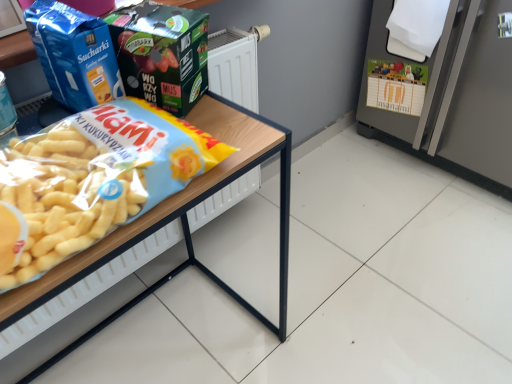
You are a GUI agent. You are given a task and a screenshot of the screen. Output one action in this format:
    pyautogui.click(x=<x>, y=<y>)
    Task: Click on the wooden table at left
    The height and width of the screenshot is (384, 512).
    Given the screenshot: What is the action you would take?
    pyautogui.click(x=180, y=221)

This screenshot has width=512, height=384. Describe the element at coordinates (74, 54) in the screenshot. I see `blue matte bag at upper left, placed as the first product when sorted from left to right` at that location.

I want to click on satin silver refrigerator at right, so pyautogui.click(x=456, y=94).

Locate an element on the screen. This screenshot has width=512, height=384. wooden table at left is located at coordinates (180, 221).

Is blue matte bag at upper left, positioned as the second product in right-to-left order, wider or thinner than matte green box at upper center, the second product in the left-to-right sequence?

In the image, blue matte bag at upper left, positioned as the second product in right-to-left order, appears to be more narrow than matte green box at upper center, the second product in the left-to-right sequence.

Which object is further away from the camera taking this photo, blue matte bag at upper left, placed as the first product when sorted from left to right, or matte green box at upper center, the second product in the left-to-right sequence?

matte green box at upper center, the second product in the left-to-right sequence.

Which is correct: blue matte bag at upper left, positioned as the second product in right-to-left order, is inside matte green box at upper center, the second product in the left-to-right sequence, or outside of it?

blue matte bag at upper left, positioned as the second product in right-to-left order, is not enclosed by matte green box at upper center, the second product in the left-to-right sequence.

In the image, is blue matte bag at upper left, positioned as the second product in right-to-left order, on the left side or the right side of matte green box at upper center, which is the first product from right to left?

blue matte bag at upper left, positioned as the second product in right-to-left order, is to the left of matte green box at upper center, which is the first product from right to left.

Is wooden table at left directly adjacent to blue matte bag at upper left, placed as the first product when sorted from left to right?

No, wooden table at left is not beside blue matte bag at upper left, placed as the first product when sorted from left to right.

From the image's perspective, is wooden table at left below blue matte bag at upper left, positioned as the second product in right-to-left order?

Yes.

From a real-world perspective, does wooden table at left stand above blue matte bag at upper left, placed as the first product when sorted from left to right?

No, from a real-world perspective, wooden table at left is not above blue matte bag at upper left, placed as the first product when sorted from left to right.

Is wooden table at left looking in the opposite direction of blue matte bag at upper left, positioned as the second product in right-to-left order?

wooden table at left is not turned away from blue matte bag at upper left, positioned as the second product in right-to-left order.

From the image's perspective, between matte green box at upper center, which is the first product from right to left, and satin silver refrigerator at right, which one is located above?

satin silver refrigerator at right is shown above in the image.

From a real-world perspective, which is physically below, matte green box at upper center, the second product in the left-to-right sequence, or satin silver refrigerator at right?

satin silver refrigerator at right is physically lower.

Is satin silver refrigerator at right completely or partially outside of blue matte bag at upper left, positioned as the second product in right-to-left order?

satin silver refrigerator at right is positioned outside blue matte bag at upper left, positioned as the second product in right-to-left order.

From a real-world perspective, is satin silver refrigerator at right on top of blue matte bag at upper left, placed as the first product when sorted from left to right?

No, from a real-world perspective, satin silver refrigerator at right is not over blue matte bag at upper left, placed as the first product when sorted from left to right

What are the coordinates of `the 2nd product below when counting from the satin silver refrigerator at right (from the image's perspective)` in the screenshot? It's located at (74, 54).

Does satin silver refrigerator at right have a larger size compared to blue matte bag at upper left, positioned as the second product in right-to-left order?

Yes.

Is wooden table at left far from satin silver refrigerator at right?

Actually, wooden table at left and satin silver refrigerator at right are a little close together.

From a real-world perspective, is wooden table at left positioned over satin silver refrigerator at right based on gravity?

No, from a real-world perspective, wooden table at left is not on top of satin silver refrigerator at right.

Which point is more distant from viewer, (250,311) or (449,162)?

The point (449,162) is farther from the camera.

From the image's perspective, is wooden table at left located above or below satin silver refrigerator at right?

From the image's perspective, wooden table at left appears below satin silver refrigerator at right.

From the image's perspective, would you say wooden table at left is positioned over matte green box at upper center, the second product in the left-to-right sequence?

Incorrect, from the image's perspective, wooden table at left is lower than matte green box at upper center, the second product in the left-to-right sequence.

Can you confirm if wooden table at left is smaller than matte green box at upper center, the second product in the left-to-right sequence?

Incorrect, wooden table at left is not smaller in size than matte green box at upper center, the second product in the left-to-right sequence.

Is wooden table at left thinner than matte green box at upper center, the second product in the left-to-right sequence?

In fact, wooden table at left might be wider than matte green box at upper center, the second product in the left-to-right sequence.

You are a GUI agent. You are given a task and a screenshot of the screen. Output one action in this format:
    pyautogui.click(x=<x>, y=<y>)
    Task: Click on the product on the right of wooden table at left
    The image size is (512, 384).
    Given the screenshot: What is the action you would take?
    pyautogui.click(x=162, y=54)

Which point is more forward, (156, 89) or (157, 207)?

Point (157, 207)

Is matte green box at upper center, which is the first product from right to left, bigger than wooden table at left?

Actually, matte green box at upper center, which is the first product from right to left, might be smaller than wooden table at left.

Is matte green box at upper center, which is the first product from right to left, positioned behind wooden table at left?

That is True.

In the image, is matte green box at upper center, which is the first product from right to left, on the left side or the right side of wooden table at left?

From the image, it's evident that matte green box at upper center, which is the first product from right to left, is to the right of wooden table at left.

I want to click on product lying below the matte green box at upper center, the second product in the left-to-right sequence (from the image's perspective), so click(x=74, y=54).

The height and width of the screenshot is (384, 512). I want to click on product that is the 2nd object above the wooden table at left (from a real-world perspective), so click(74, 54).

From the image, which object appears to be nearer to matte green box at upper center, the second product in the left-to-right sequence, wooden table at left or blue matte bag at upper left, positioned as the second product in right-to-left order?

blue matte bag at upper left, positioned as the second product in right-to-left order.

Which object lies further to the anchor point wooden table at left, satin silver refrigerator at right or matte green box at upper center, the second product in the left-to-right sequence?

satin silver refrigerator at right lies further to wooden table at left than the other object.

From the image, which object appears to be nearer to wooden table at left, blue matte bag at upper left, positioned as the second product in right-to-left order, or matte green box at upper center, the second product in the left-to-right sequence?

Among the two, matte green box at upper center, the second product in the left-to-right sequence, is located nearer to wooden table at left.

Based on the photo, which object lies nearer to the anchor point matte green box at upper center, which is the first product from right to left, wooden table at left or satin silver refrigerator at right?

The object closer to matte green box at upper center, which is the first product from right to left, is wooden table at left.

Looking at the image, which one is located further to satin silver refrigerator at right, matte green box at upper center, the second product in the left-to-right sequence, or blue matte bag at upper left, positioned as the second product in right-to-left order?

Among the two, blue matte bag at upper left, positioned as the second product in right-to-left order, is located further to satin silver refrigerator at right.

Looking at the image, which one is located further to satin silver refrigerator at right, wooden table at left or blue matte bag at upper left, placed as the first product when sorted from left to right?

blue matte bag at upper left, placed as the first product when sorted from left to right, is positioned further to the anchor satin silver refrigerator at right.

Which object lies nearer to the anchor point matte green box at upper center, which is the first product from right to left, satin silver refrigerator at right or wooden table at left?

wooden table at left is closer to matte green box at upper center, which is the first product from right to left.

Estimate the real-world distances between objects in this image. Which object is closer to blue matte bag at upper left, placed as the first product when sorted from left to right, wooden table at left or matte green box at upper center, the second product in the left-to-right sequence?

matte green box at upper center, the second product in the left-to-right sequence, lies closer to blue matte bag at upper left, placed as the first product when sorted from left to right, than the other object.

At what (x,y) coordinates should I click in order to perform the action: click on table between blue matte bag at upper left, placed as the first product when sorted from left to right, and satin silver refrigerator at right from left to right. Please return your answer as a coordinate pair (x, y). Image resolution: width=512 pixels, height=384 pixels. Looking at the image, I should click on (180, 221).

Identify the location of product between wooden table at left and satin silver refrigerator at right in the horizontal direction. (162, 54).

This screenshot has width=512, height=384. What are the coordinates of `product between matte green box at upper center, the second product in the left-to-right sequence, and wooden table at left in the up-down direction` in the screenshot? It's located at (74, 54).

At what (x,y) coordinates should I click in order to perform the action: click on product between blue matte bag at upper left, positioned as the second product in right-to-left order, and satin silver refrigerator at right. Please return your answer as a coordinate pair (x, y). Looking at the image, I should click on (162, 54).